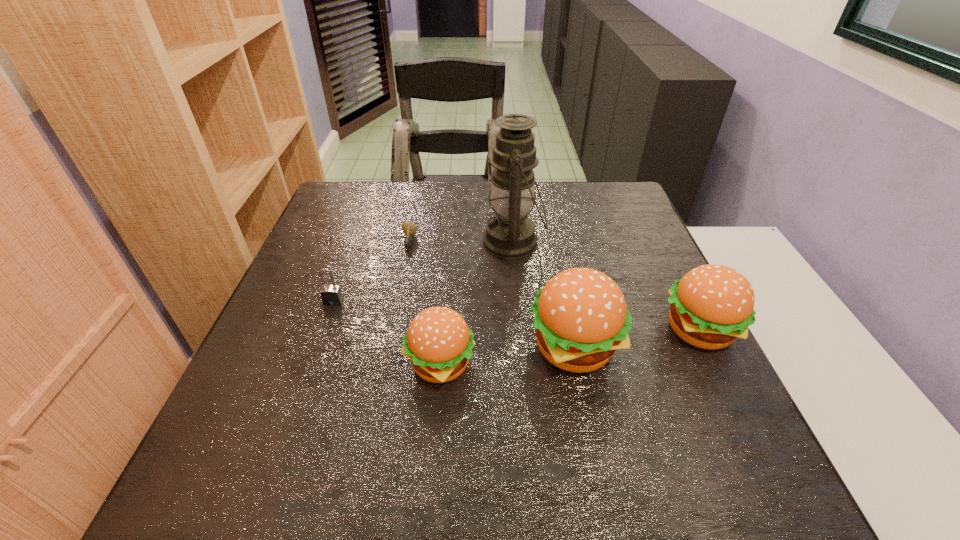
This screenshot has height=540, width=960. Find the location of `vacant place for an extra hamburger on the left`. vacant place for an extra hamburger on the left is located at coordinates (295, 384).